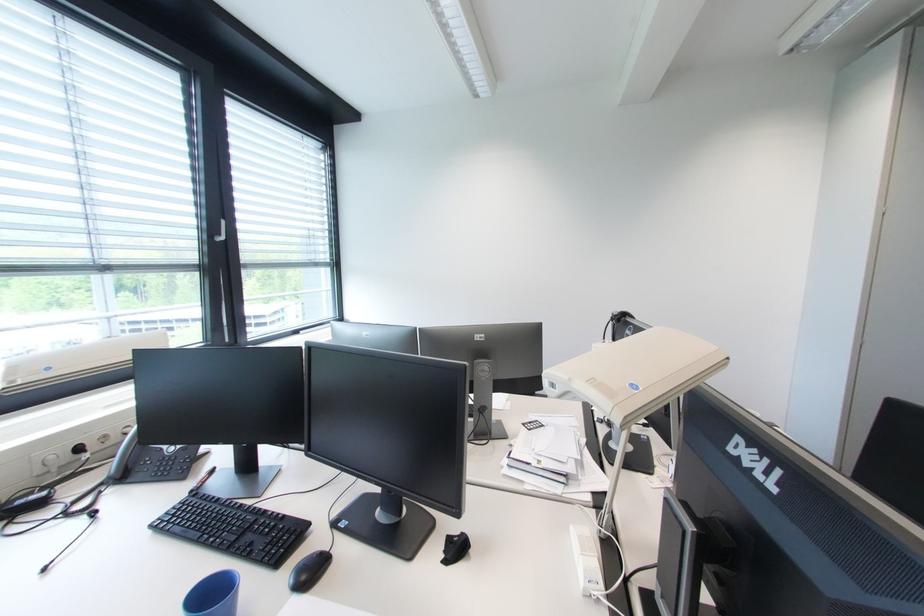
Find the location of a particular element. telephone keypad is located at coordinates (234, 528).